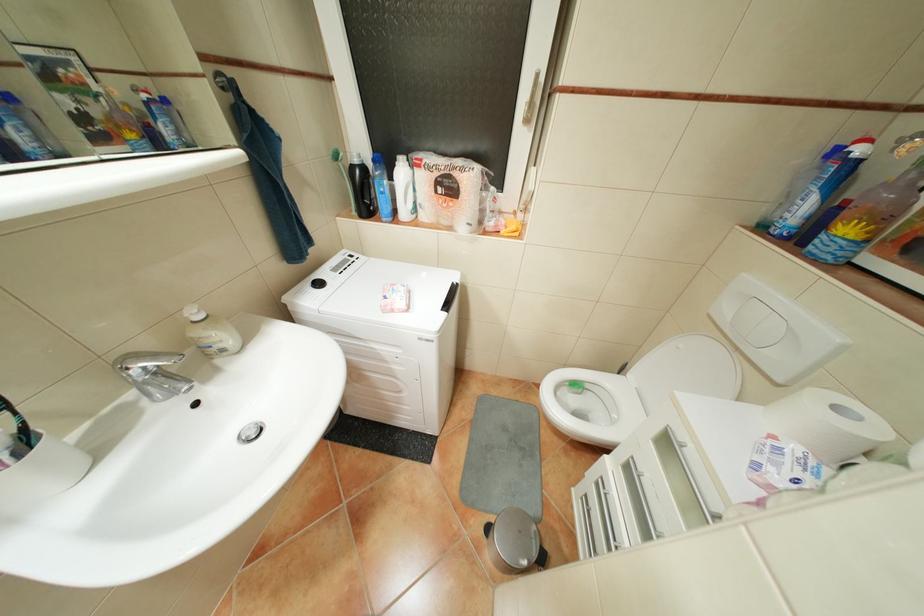
This screenshot has width=924, height=616. Find the location of `trash can pedal`. trash can pedal is located at coordinates (541, 559).